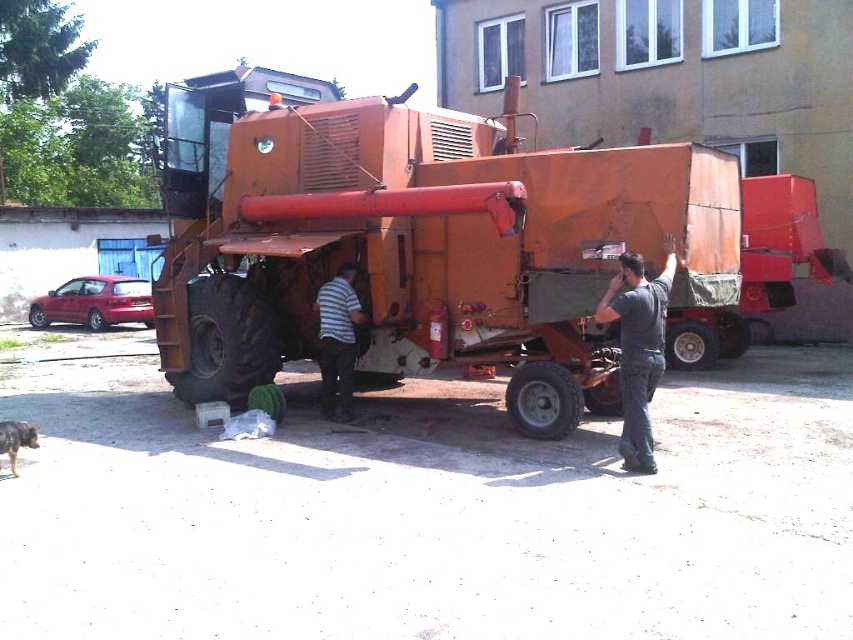
Question: Can you confirm if rusty metal tractor at center is positioned to the right of dark gray shirt at center?

Choices:
 (A) yes
 (B) no

Answer: (B)

Question: Which is farther from the rusty metal tractor at center?

Choices:
 (A) dark gray shirt at center
 (B) striped shirt at center

Answer: (A)

Question: Estimate the real-world distances between objects in this image. Which object is closer to the rusty metal tractor at center?

Choices:
 (A) striped shirt at center
 (B) dark gray shirt at center

Answer: (A)

Question: Can you confirm if rusty metal tractor at center is wider than dark gray shirt at center?

Choices:
 (A) no
 (B) yes

Answer: (A)

Question: Which object is positioned farthest from the striped shirt at center?

Choices:
 (A) rusty metal tractor at center
 (B) dark gray shirt at center

Answer: (A)

Question: Can you confirm if rusty metal tractor at center is positioned below striped shirt at center?

Choices:
 (A) yes
 (B) no

Answer: (B)